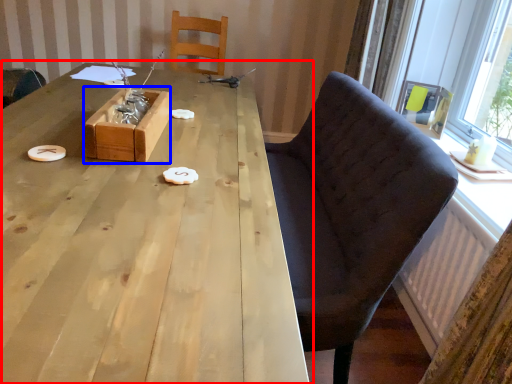
Question: Which object appears closest to the camera in this image, table (highlighted by a red box) or box (highlighted by a blue box)?

Choices:
 (A) table
 (B) box

Answer: (A)